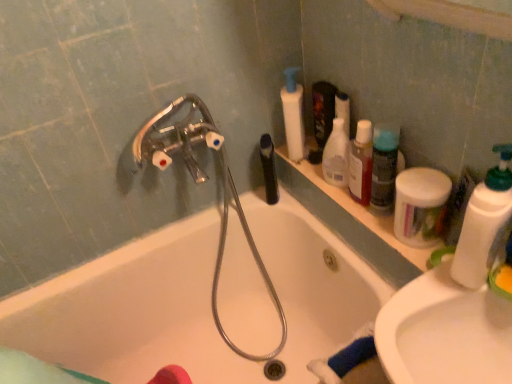
Locate an element on the screen. This screenshot has width=512, height=384. free space between translucent plastic spray bottle at upper right, acting as the second cleaning product starting from the back, and white plastic pump bottle at upper center, which is the first cleaning product in back-to-front order is located at coordinates (305, 161).